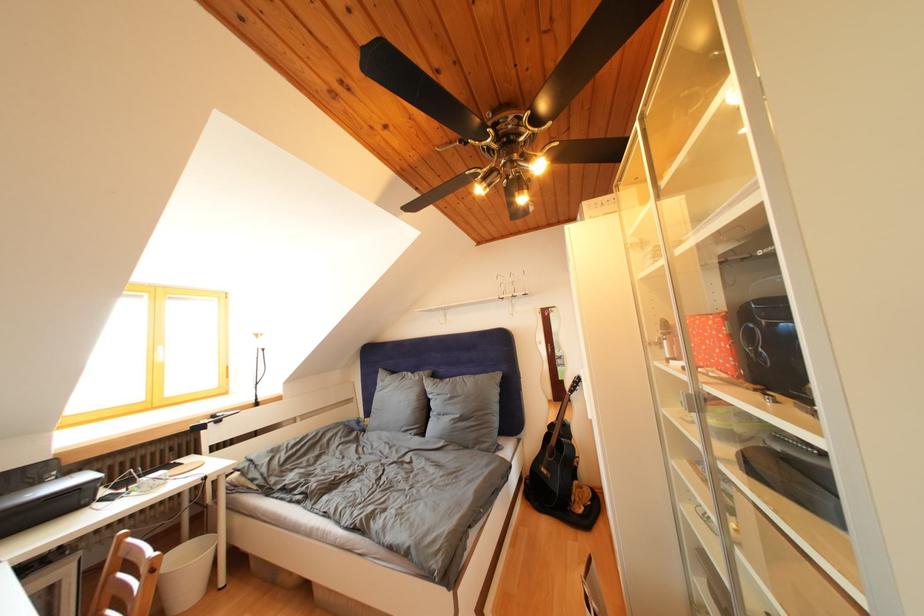
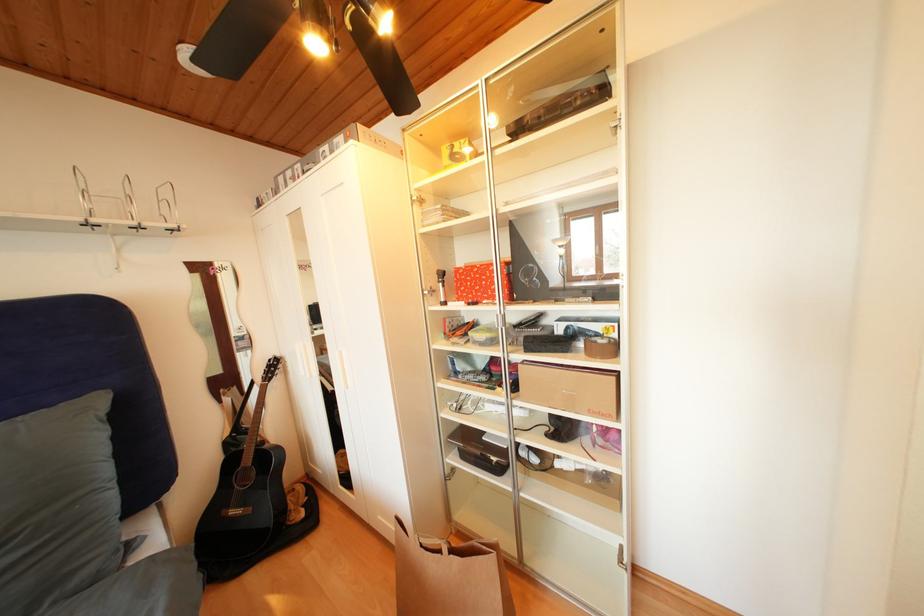
Question: The images are taken continuously from a first-person perspective. In which direction is your viewpoint rotating?

Choices:
 (A) Left
 (B) Right
 (C) Up
 (D) Down

Answer: (B)